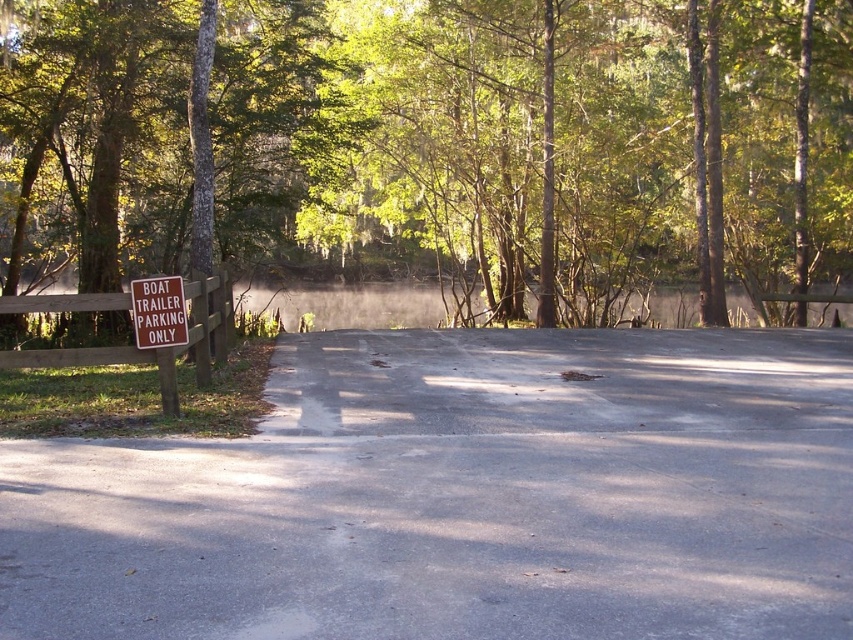
Consider the image. You are a boat owner who needs to park your trailer in the designated area. Your trailer is 18 feet long. There is a green leafy tree at upper center and misty water at center. Can you park your trailer between them without it overlapping either?

The distance between the green leafy tree at upper center and the misty water at center is 17.94 feet. Since your trailer is 18 feet long, it would be slightly too long to fit between them without overlapping either object.

You are a visitor trying to find the boat trailer parking area. You see the misty water at center and the brown wooden sign at left. Which object should you look at to determine the correct parking area?

The brown wooden sign at left indicates the parking area since it has the sign stating BOAT TRAILER PARKING ONLY, so you should look at the brown wooden sign at left.